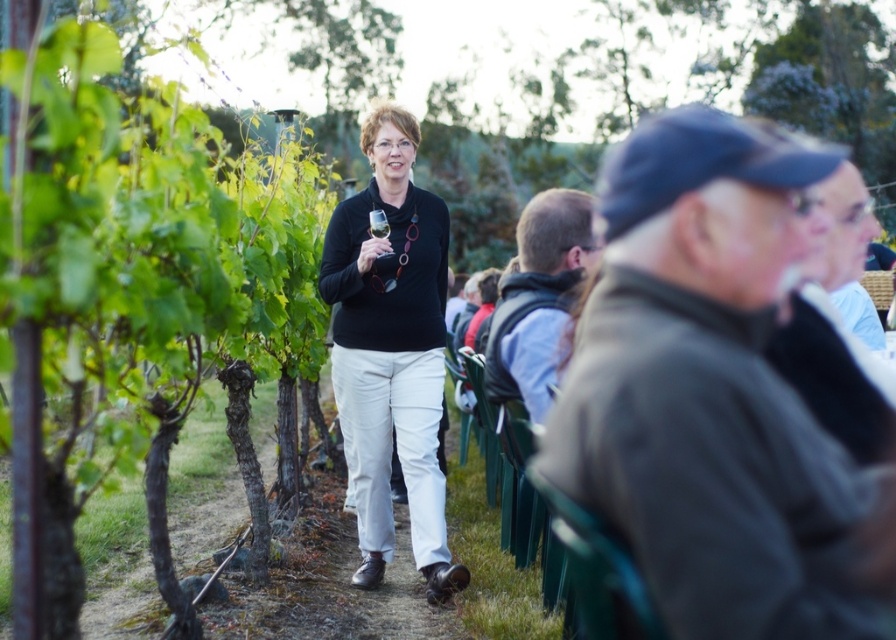
Question: Considering the relative positions of light brown leather jacket at center and light blue shirt at right in the image provided, where is light brown leather jacket at center located with respect to light blue shirt at right?

Choices:
 (A) above
 (B) below

Answer: (B)

Question: In this image, where is gray knit cap at right located relative to light blue shirt at right?

Choices:
 (A) above
 (B) below

Answer: (B)

Question: Estimate the real-world distances between objects in this image. Which object is closer to the matte black sweater at center?

Choices:
 (A) gray knit cap at right
 (B) light blue shirt at right
 (C) light brown leather jacket at center

Answer: (C)

Question: Which point appears closest to the camera in this image?

Choices:
 (A) (843, 256)
 (B) (535, 198)
 (C) (842, 269)
 (D) (656, 516)

Answer: (D)

Question: Is light brown leather jacket at center above light blue shirt at right?

Choices:
 (A) yes
 (B) no

Answer: (B)

Question: Estimate the real-world distances between objects in this image. Which object is farther from the gray knit cap at right?

Choices:
 (A) light brown leather jacket at center
 (B) light blue shirt at right
 (C) dark brown leather jacket at right

Answer: (A)